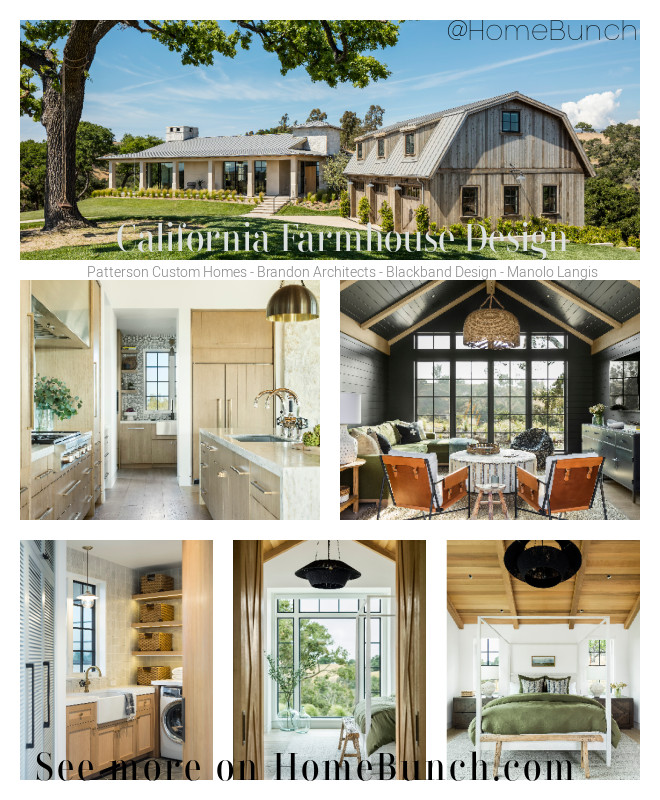
The width and height of the screenshot is (660, 800). I want to click on bed, so click(x=532, y=714), click(x=377, y=722).